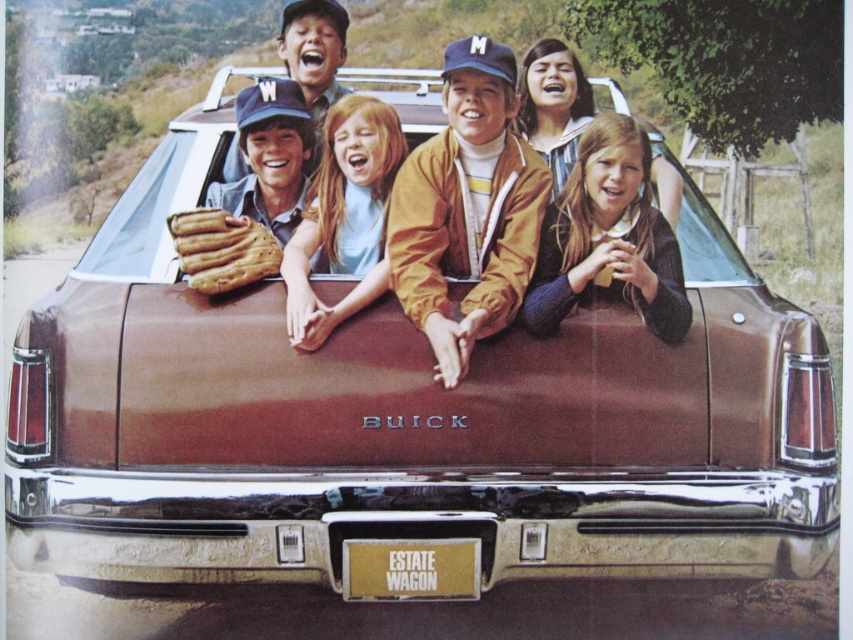
Between brown matte jacket at center and matte brown baseball glove at center, which one has less height?

matte brown baseball glove at center is shorter.

Can you confirm if brown matte jacket at center is positioned to the right of matte brown baseball glove at center?

Indeed, brown matte jacket at center is positioned on the right side of matte brown baseball glove at center.

Which is in front, point (479, 189) or point (229, 156)?

Point (479, 189) is in front.

This screenshot has height=640, width=853. Find the location of `brown matte jacket at center`. brown matte jacket at center is located at coordinates tap(467, 209).

From the picture: Can you confirm if knitted sweater at center is thinner than matte brown baseball glove at center?

Indeed, knitted sweater at center has a lesser width compared to matte brown baseball glove at center.

Consider the image. Between knitted sweater at center and matte brown baseball glove at center, which one appears on the right side from the viewer's perspective?

Positioned to the right is knitted sweater at center.

Locate an element on the screen. Image resolution: width=853 pixels, height=640 pixels. knitted sweater at center is located at coordinates (608, 237).

Is knitted sweater at center closer to camera compared to brown leather baseball glove at center?

That is True.

Between point (607, 204) and point (186, 211), which one is positioned in front?

Point (186, 211) is more forward.

Where is `knitted sweater at center`? The image size is (853, 640). knitted sweater at center is located at coordinates (608, 237).

Identify the location of knitted sweater at center. The height and width of the screenshot is (640, 853). (608, 237).